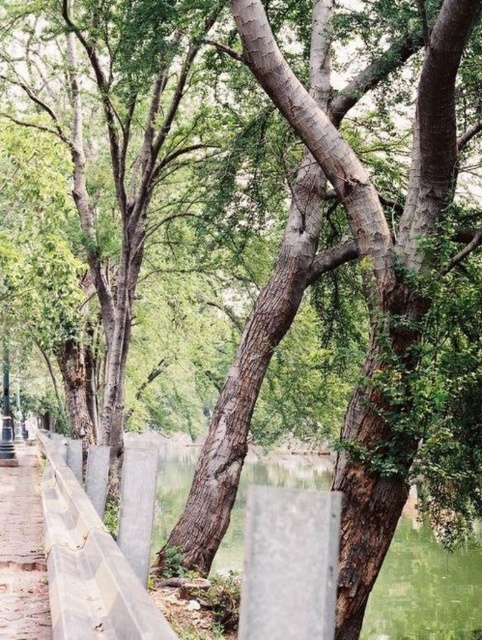
Question: Can you confirm if green water at center is bigger than brown stone pavement at lower left?

Choices:
 (A) no
 (B) yes

Answer: (B)

Question: Among these objects, which one is nearest to the camera?

Choices:
 (A) green water at center
 (B) brown stone pavement at lower left

Answer: (B)

Question: Which point is farther from the camera taking this photo?

Choices:
 (A) (7, 515)
 (B) (458, 566)

Answer: (B)

Question: Is green water at center above brown stone pavement at lower left?

Choices:
 (A) no
 (B) yes

Answer: (A)

Question: Where is green water at center located in relation to brown stone pavement at lower left in the image?

Choices:
 (A) below
 (B) above

Answer: (A)